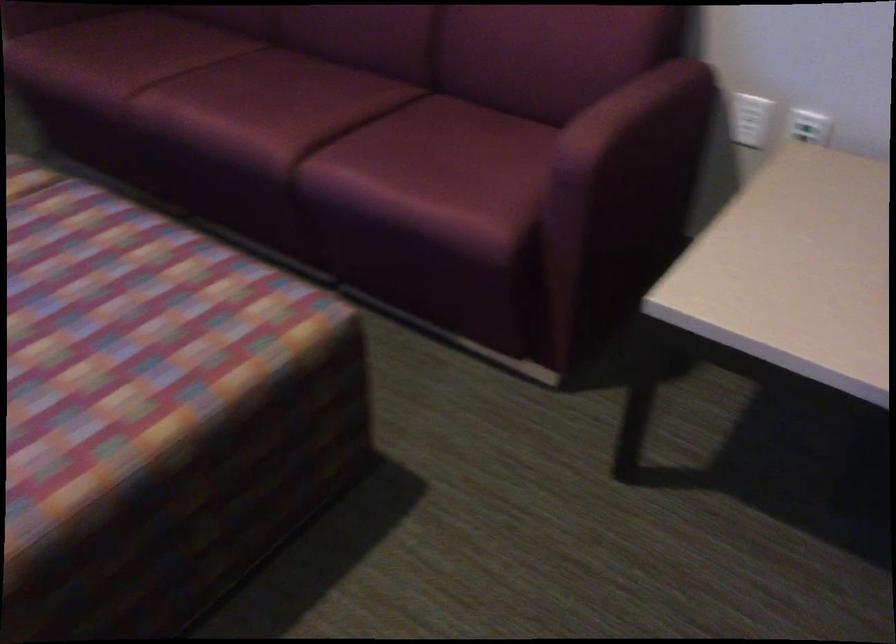
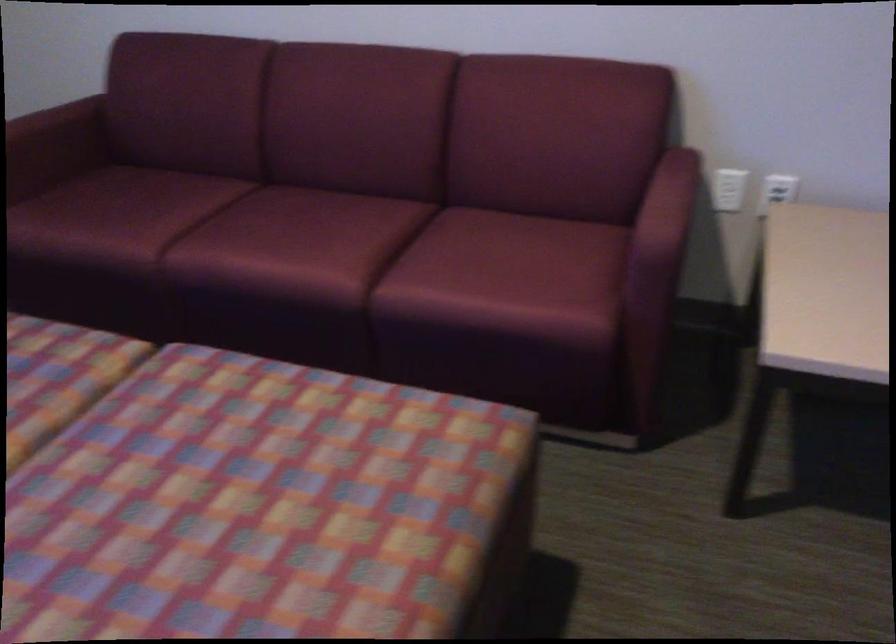
Where in the second image is the point corresponding to point (666, 82) from the first image?

(678, 166)